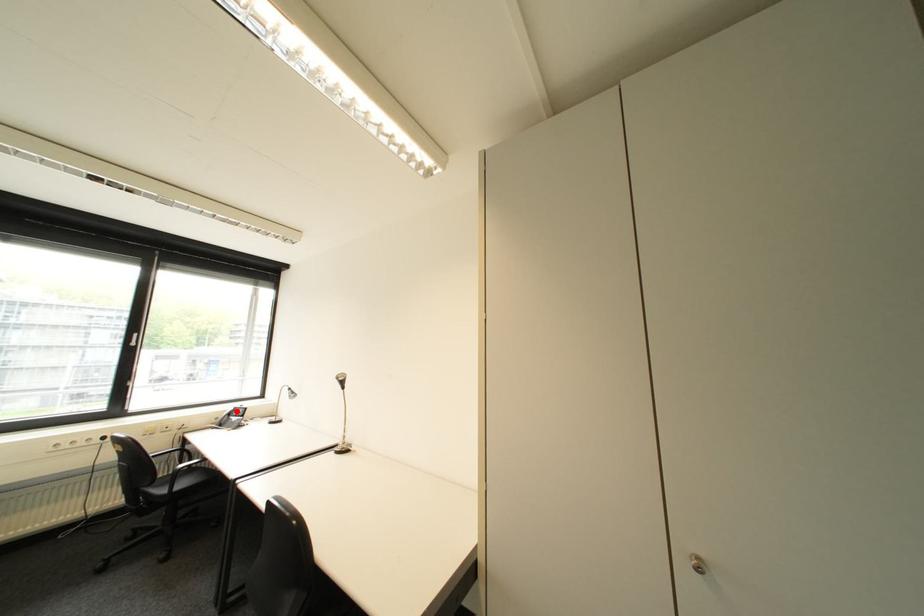
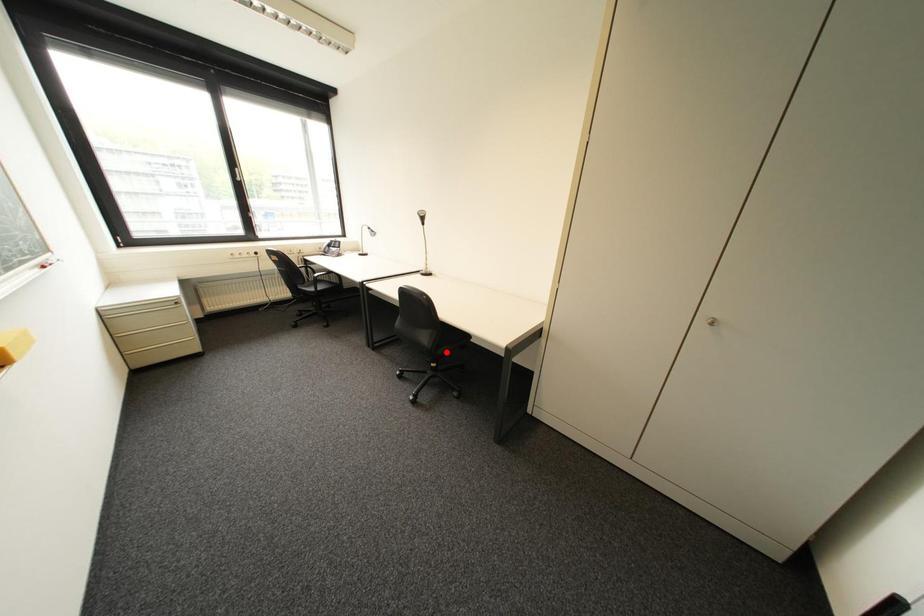
I am providing you with two images of the same scene from different viewpoints. A red point is marked on the first image and another point is marked on the second image. Does the point marked in image1 correspond to the same location as the one in image2?

No